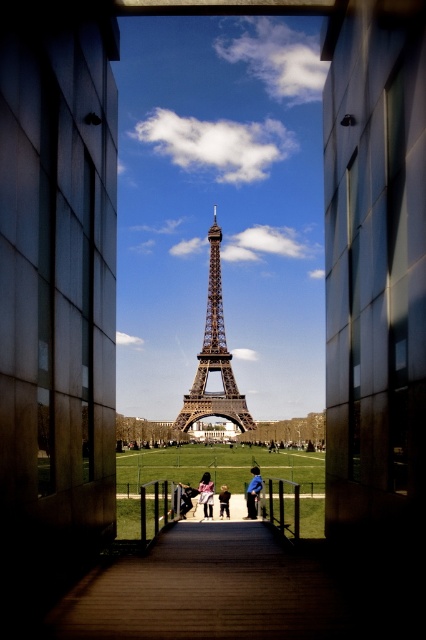
You are a photographer standing on a walkway in front of the Eiffel Tower. You notice a matte pink dress at center and light blue jeans at center. Which clothing item is positioned higher relative to the other?

The matte pink dress at center is located above the light blue jeans at center, so it is positioned higher.

You are standing at the base of the Eiffel Tower and notice two points marked on the walkway leading towards the tower. The first point is located at coordinates point (245,497) and the second at point (207,472). If you were to walk from the first point to the second, would you be moving towards or away from the Eiffel Tower?

Since point (245,497) is in front of point (207,472), walking from the first point to the second would mean moving away from the Eiffel Tower.